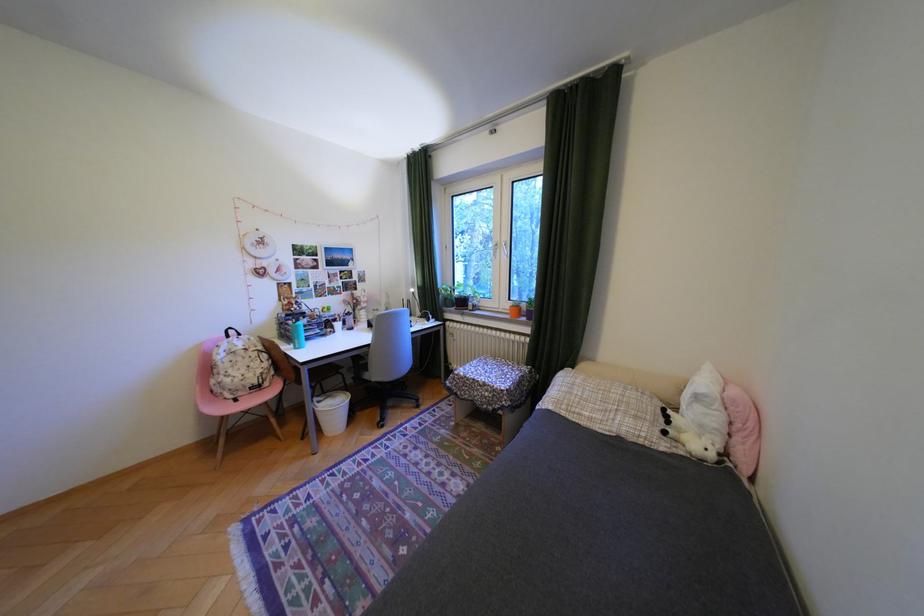
I want to click on patterned stool, so click(x=228, y=398).